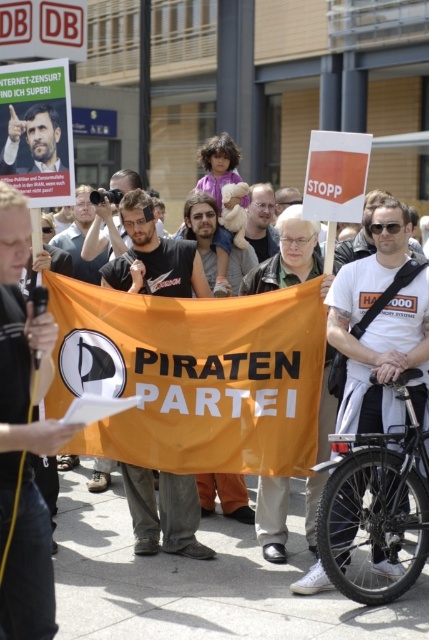
Who is more distant from viewer, (413, 376) or (148, 209)?

The point (148, 209) is behind.

Does point (392, 452) come in front of point (126, 220)?

Yes, point (392, 452) is closer to viewer.

The width and height of the screenshot is (429, 640). I want to click on black matte bicycle at lower right, so click(377, 496).

Which of these two, black leather pants at center or black matte bicycle at lower right, stands shorter?

black matte bicycle at lower right is shorter.

Is point (69, 428) less distant than point (417, 570)?

Yes, it is in front of point (417, 570).

Is point (33, 529) farther from camera compared to point (320, 512)?

No, it is not.

The image size is (429, 640). In order to click on black leather pants at center in this screenshot , I will do `click(21, 356)`.

Is black leather pants at center to the right of matte black poster at upper left from the viewer's perspective?

Indeed, black leather pants at center is positioned on the right side of matte black poster at upper left.

The image size is (429, 640). Describe the element at coordinates (21, 356) in the screenshot. I see `black leather pants at center` at that location.

Find the location of a particular element. This screenshot has height=640, width=429. black leather pants at center is located at coordinates (21, 356).